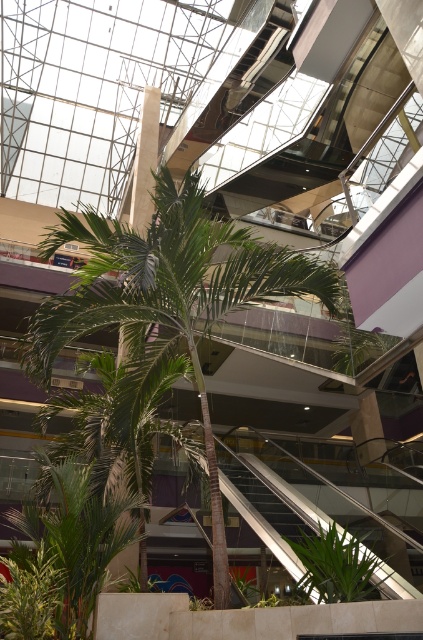
Can you confirm if metallic silver escalator at lower center is shorter than green leafy plant at center?

Yes.

Where is `metallic silver escalator at lower center`? metallic silver escalator at lower center is located at coordinates (280, 488).

Locate an element on the screen. The image size is (423, 640). metallic silver escalator at lower center is located at coordinates (280, 488).